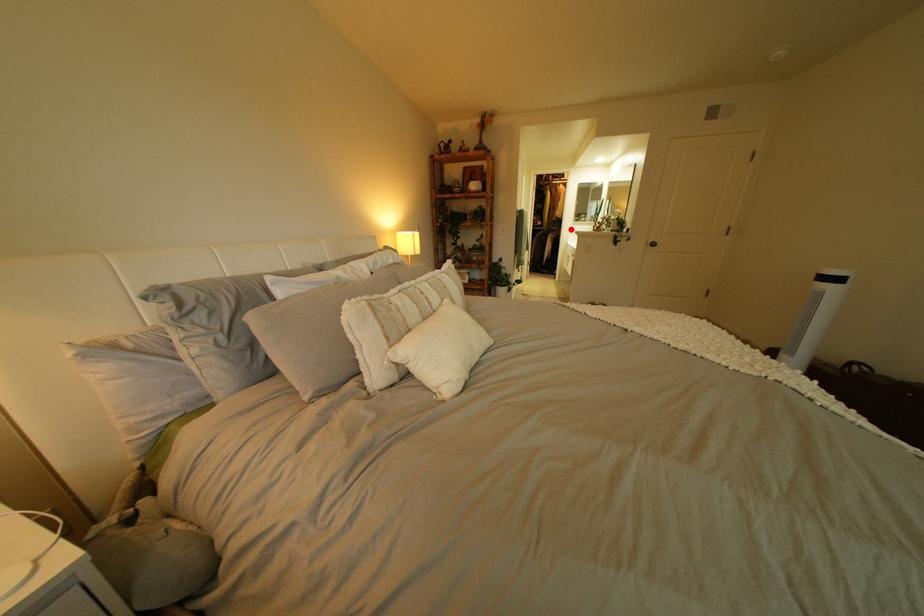
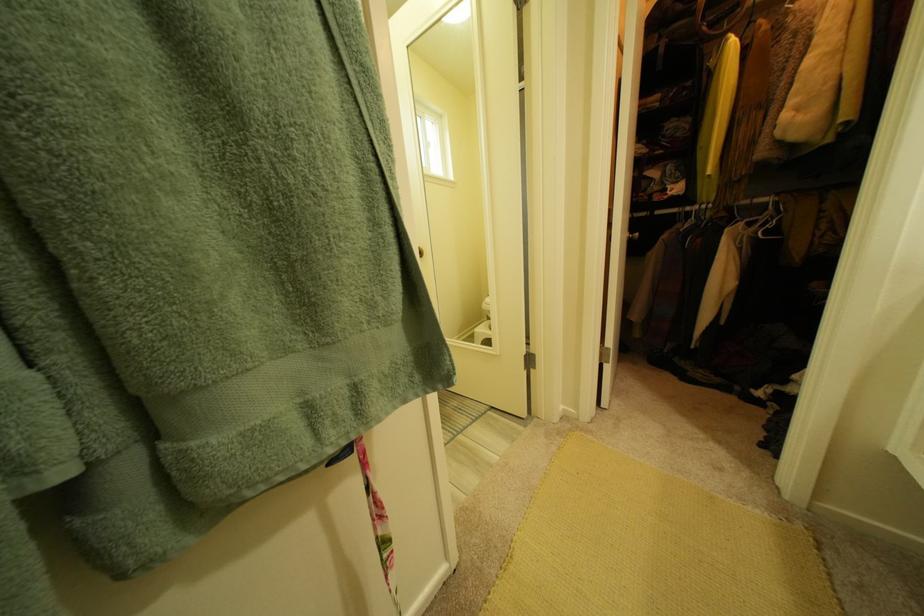
Question: I am providing you with two images of the same scene from different viewpoints. Given a red point in image1, look at the same physical point in image2. Is it:

Choices:
 (A) Closer to the viewpoint
 (B) Farther from the viewpoint

Answer: (B)